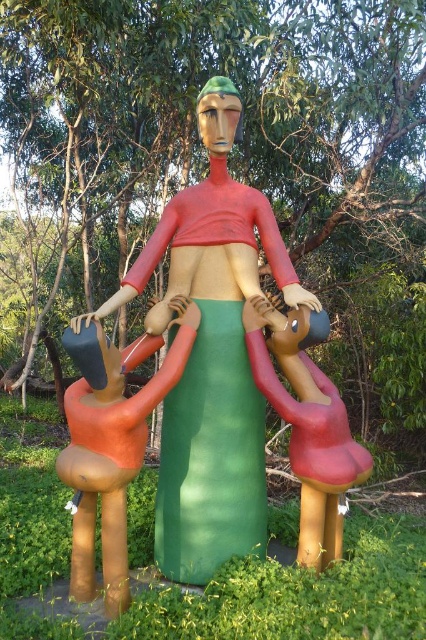
Question: Can you confirm if matte green dress at center is wider than matte orange figure at lower left?

Choices:
 (A) yes
 (B) no

Answer: (A)

Question: Among these points, which one is nearest to the camera?

Choices:
 (A) (331, 490)
 (B) (65, 410)
 (C) (247, 205)

Answer: (A)

Question: Can you confirm if matte green dress at center is positioned above matte orange figure at lower left?

Choices:
 (A) yes
 (B) no

Answer: (A)

Question: Where is matte green dress at center located in relation to matte red figure at center in the image?

Choices:
 (A) below
 (B) above

Answer: (B)

Question: Which point is farther to the camera?

Choices:
 (A) (273, 344)
 (B) (89, 554)

Answer: (A)

Question: Among these points, which one is nearest to the camera?

Choices:
 (A) pyautogui.click(x=252, y=301)
 (B) pyautogui.click(x=170, y=346)

Answer: (B)